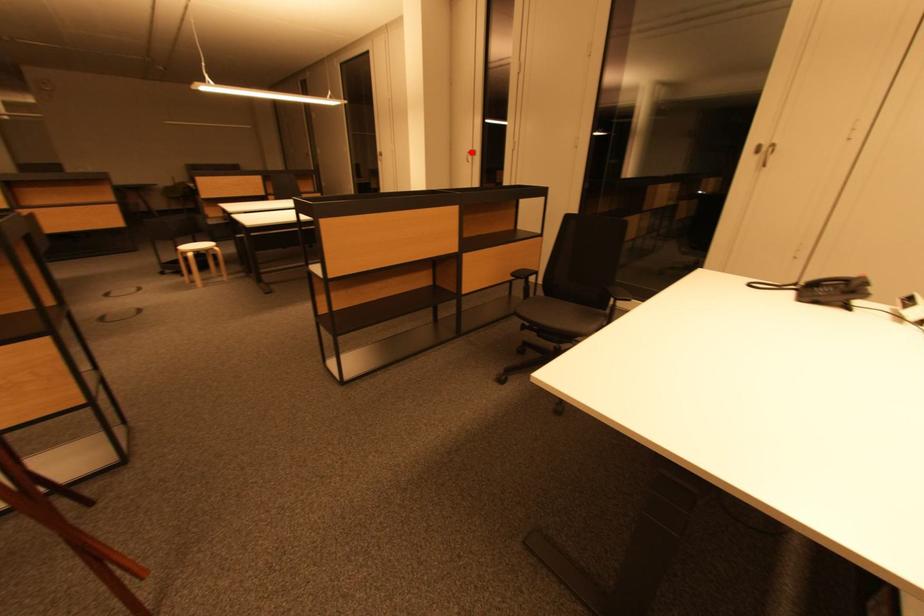
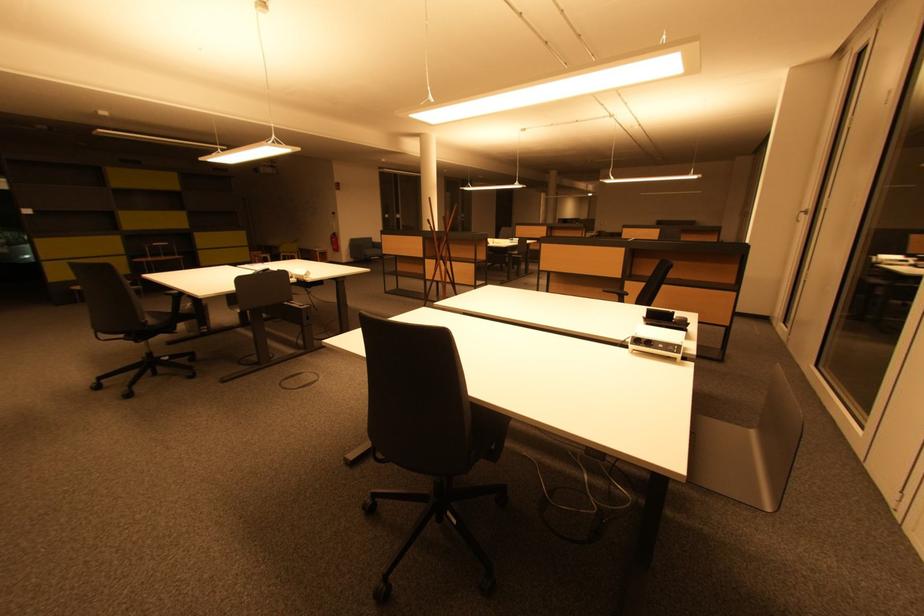
In the second image, find the point that corresponds to the highlighted location in the first image.

(808, 212)